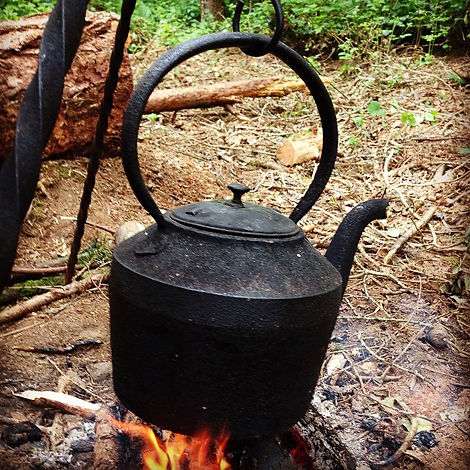
You are a GUI agent. You are given a task and a screenshot of the screen. Output one action in this format:
    pyautogui.click(x=<x>, y=<y>)
    Task: Click on the pot
    
    Given the screenshot: What is the action you would take?
    pyautogui.click(x=235, y=296)